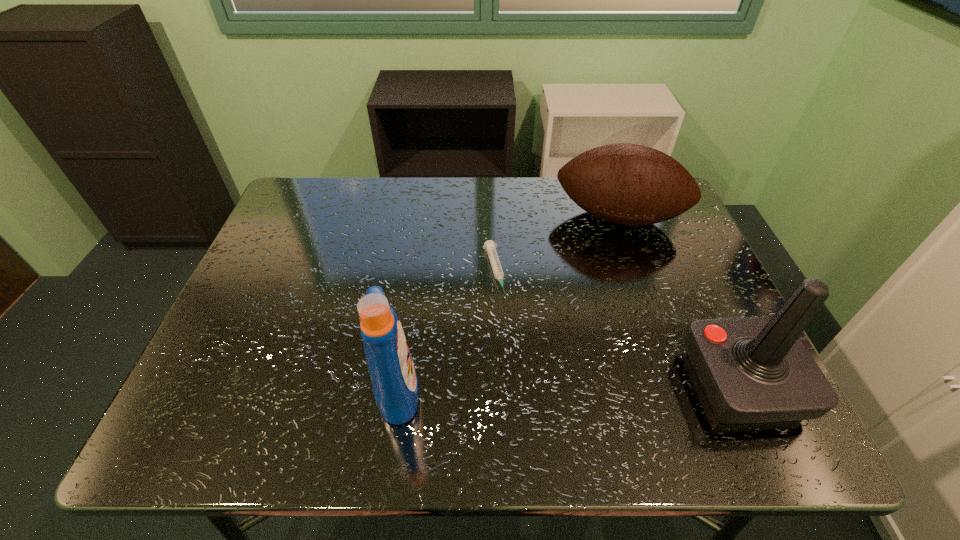
I want to click on object that is at the near right corner, so click(752, 369).

Locate an element on the screen. Image resolution: width=960 pixels, height=540 pixels. free space at the far edge is located at coordinates (539, 225).

The width and height of the screenshot is (960, 540). I want to click on free space at the near edge, so click(684, 384).

Locate an element on the screen. The width and height of the screenshot is (960, 540). vacant space at the left edge of the desktop is located at coordinates (238, 301).

This screenshot has width=960, height=540. Identify the location of vacant space at the right edge. (684, 271).

This screenshot has width=960, height=540. Find the location of `free location at the far left corner`. free location at the far left corner is located at coordinates (297, 191).

In the image, there is a desktop. Where is `free space at the near left corner`? The image size is (960, 540). free space at the near left corner is located at coordinates (218, 366).

At what (x,y) coordinates should I click in order to perform the action: click on empty space between the second farthest object and the joystick. Please return your answer as a coordinate pair (x, y). The width and height of the screenshot is (960, 540). Looking at the image, I should click on (617, 328).

Find the location of `free spot between the joystick and the second shortest object`. free spot between the joystick and the second shortest object is located at coordinates [681, 300].

Locate an element on the screen. This screenshot has width=960, height=540. free space between the leftmost object and the joystick is located at coordinates [x=569, y=386].